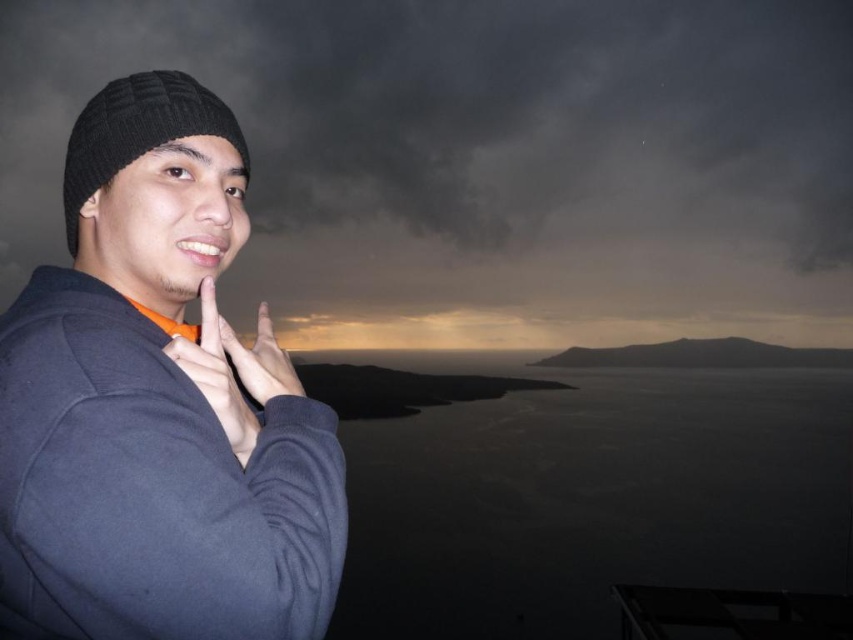
Question: Which of the following is the farthest from the observer?

Choices:
 (A) matte orange shirt at left
 (B) dark matte water at lower right

Answer: (B)

Question: Can you confirm if dark matte water at lower right is smaller than black knitted hat at left?

Choices:
 (A) no
 (B) yes

Answer: (A)

Question: Estimate the real-world distances between objects in this image. Which object is farther from the matte orange shirt at left?

Choices:
 (A) dark matte water at lower right
 (B) knitted wool beanie at left
 (C) matte black hand at center

Answer: (A)

Question: Is knitted wool beanie at left wider than matte black hand at center?

Choices:
 (A) yes
 (B) no

Answer: (A)

Question: Which object is farther from the camera taking this photo?

Choices:
 (A) matte black hand at center
 (B) knitted wool beanie at left
 (C) dark matte water at lower right

Answer: (C)

Question: From the image, what is the correct spatial relationship of dark matte water at lower right in relation to black knitted hat at left?

Choices:
 (A) below
 (B) above

Answer: (A)